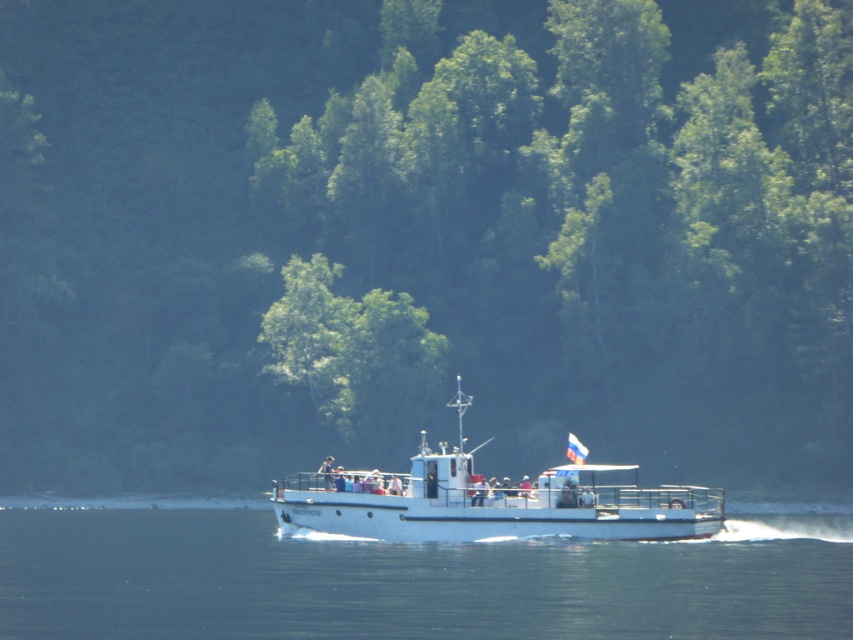
You are standing on the deck of the white passenger boat and want to take a photo of the point at coordinates point (282,561). Given that the camera you have can focus on objects up to 250 feet away, will the point be in focus?

The point (282,561) is 243.08 feet away from the camera. Since the camera can focus up to 250 feet, the point will be within the focus range and should be in focus.

You are on a boat trip and want to know the position of the clear blue water at center relative to the white matte boat at center. Which side of the boat is the water located on?

The clear blue water at center is to the left of the white matte boat at center.

You are a photographer trying to capture the white matte boat at center and the green leafy tree at center in the same frame. Based on their heights, which object would appear taller in your photo?

The green leafy tree at center appears taller than the white matte boat at center in the photo because the white matte boat at center has a lesser height compared to the green leafy tree at center.